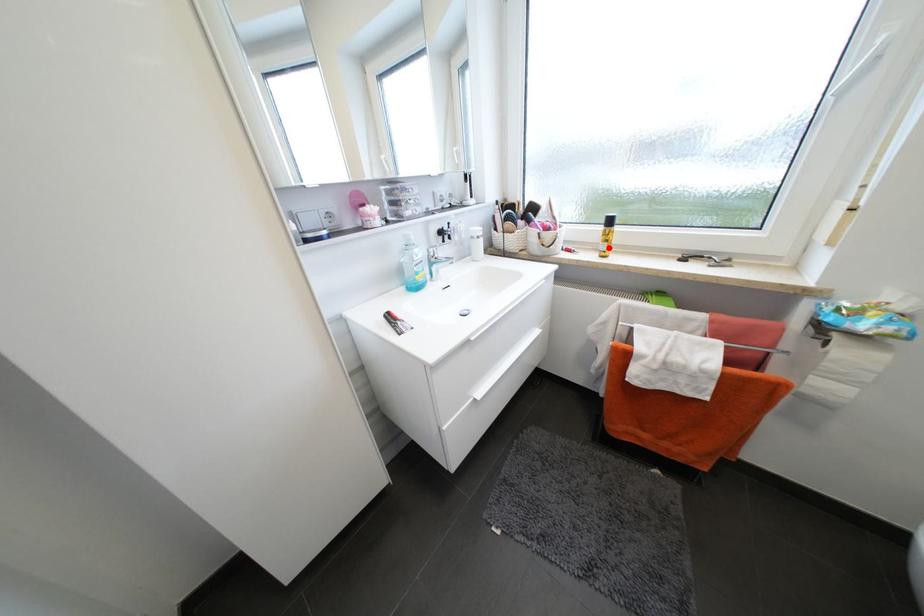
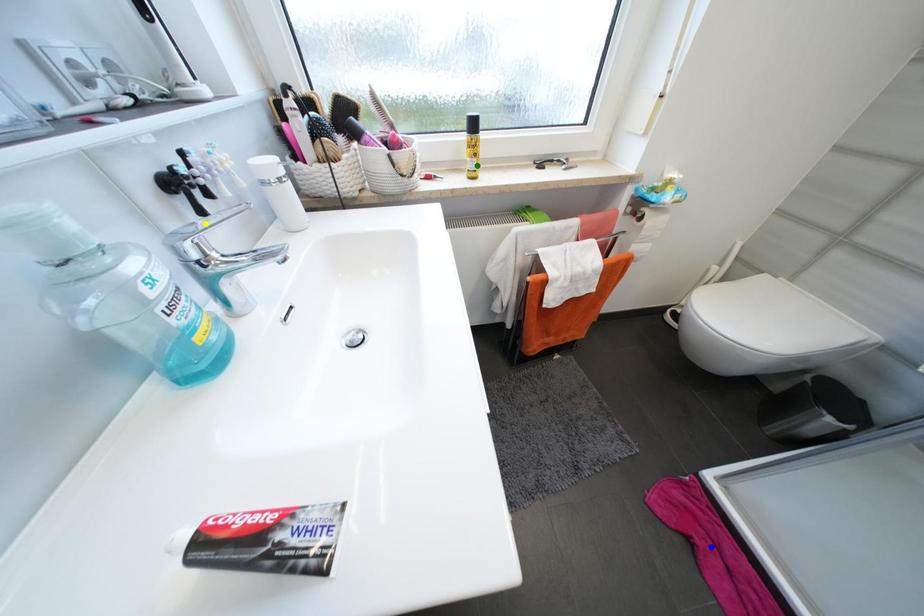
Question: I am providing you with two images of the same scene from different viewpoints. A red point is marked on the first image. You are given multiple points on the second image. Which point in image 2 represents the same 3d spot as the red point in image 1?

Choices:
 (A) blue point
 (B) green point
 (C) yellow point

Answer: (B)